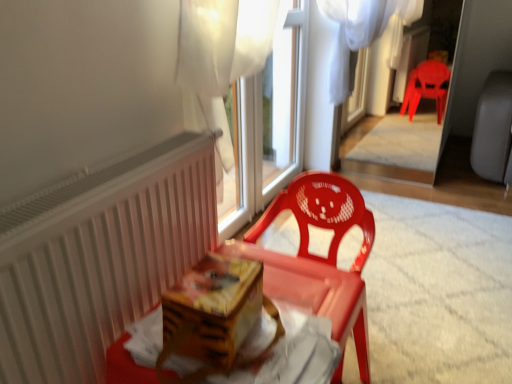
Identify the location of vacant area on top of white matte radiator at left (from a real-world perspective). This screenshot has width=512, height=384. (116, 168).